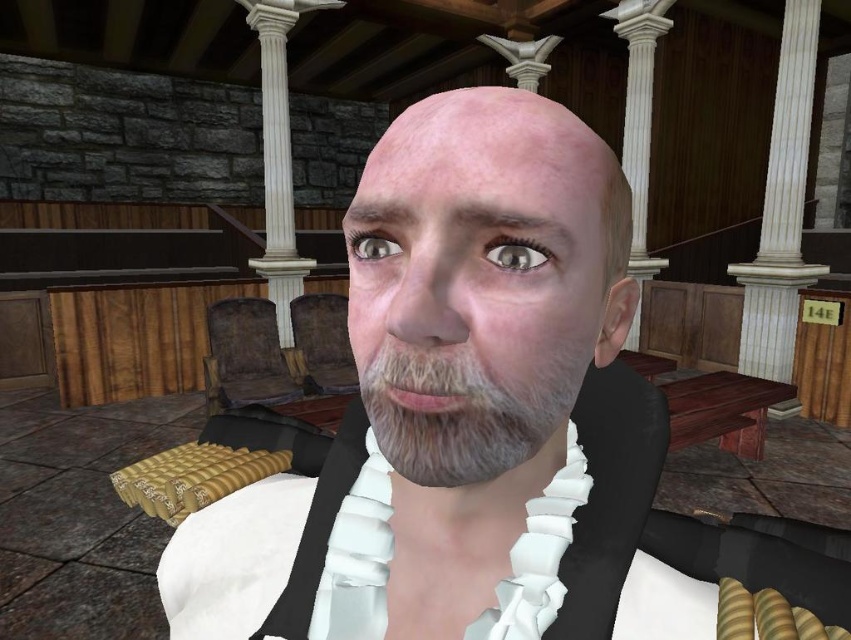
Question: Which point is farther to the camera?

Choices:
 (A) (390, 352)
 (B) (507, 381)
 (C) (520, 259)

Answer: (A)

Question: Observing the image, what is the correct spatial positioning of graywoolly/fuzzybeard at center in reference to shiny gray eye at center?

Choices:
 (A) above
 (B) below

Answer: (B)

Question: Which of the following is the closest to the observer?

Choices:
 (A) (465, 449)
 (B) (541, 260)
 (C) (415, 208)
 (D) (386, 248)

Answer: (C)

Question: Does smooth skin face at center appear under matte skin eye at center?

Choices:
 (A) yes
 (B) no

Answer: (A)

Question: Can you confirm if smooth skin face at center is positioned to the left of graywoolly/fuzzybeard at center?

Choices:
 (A) yes
 (B) no

Answer: (B)

Question: Considering the real-world distances, which object is farthest from the graywoolly/fuzzybeard at center?

Choices:
 (A) matte skin eye at center
 (B) shiny gray eye at center
 (C) smooth skin face at center
 (D) white matte/soft fabric at center

Answer: (D)